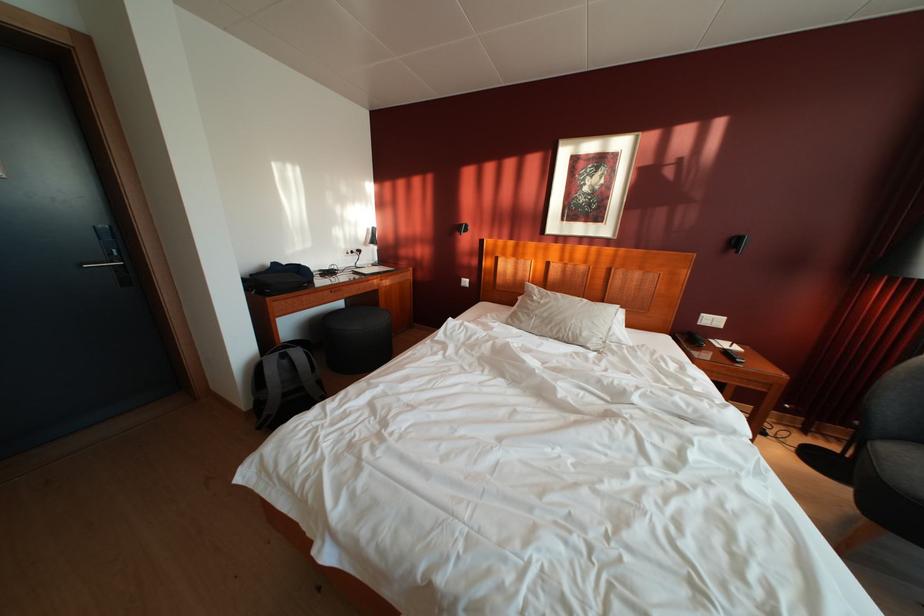
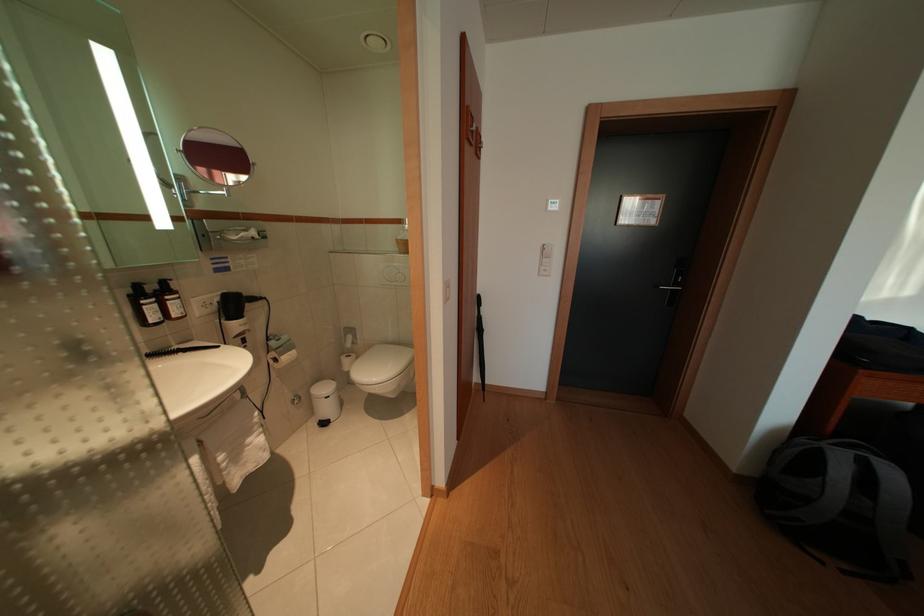
Question: The camera is either moving clockwise (left) or counter-clockwise (right) around the object. The first image is from the beginning of the video and the second image is from the end. Is the camera moving left or right when shooting the video?

Choices:
 (A) Left
 (B) Right

Answer: (B)